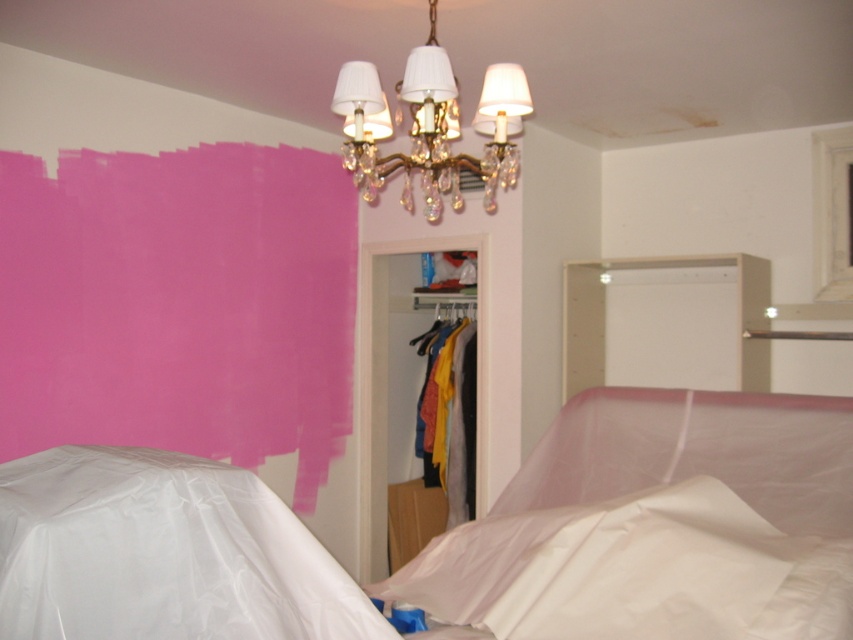
At what (x,y) coordinates should I click in order to perform the action: click on white matte plastic sheet at lower center. Please return your answer as a coordinate pair (x, y). This screenshot has height=640, width=853. Looking at the image, I should click on (633, 572).

Which of these two, white matte plastic sheet at lower center or matte plastic clothes at center, stands taller?

Standing taller between the two is matte plastic clothes at center.

Where is `white matte plastic sheet at lower center`? Image resolution: width=853 pixels, height=640 pixels. white matte plastic sheet at lower center is located at coordinates (633, 572).

Who is positioned more to the left, white plastic bed at lower left or gold crystal chandelier at upper center?

From the viewer's perspective, gold crystal chandelier at upper center appears more on the left side.

Does white plastic bed at lower left have a smaller size compared to gold crystal chandelier at upper center?

Incorrect, white plastic bed at lower left is not smaller in size than gold crystal chandelier at upper center.

Measure the distance between point (155, 620) and camera.

4.69 feet

Where is `white plastic bed at lower left`? white plastic bed at lower left is located at coordinates (463, 536).

Which of these two, white plastic bed at lower left or white matte plastic sheet at lower center, stands shorter?

white matte plastic sheet at lower center

Which is above, white plastic bed at lower left or white matte plastic sheet at lower center?

white plastic bed at lower left

Which is in front, point (645, 602) or point (718, 566)?

Point (645, 602)

The width and height of the screenshot is (853, 640). Find the location of `white plastic bed at lower left`. white plastic bed at lower left is located at coordinates (463, 536).